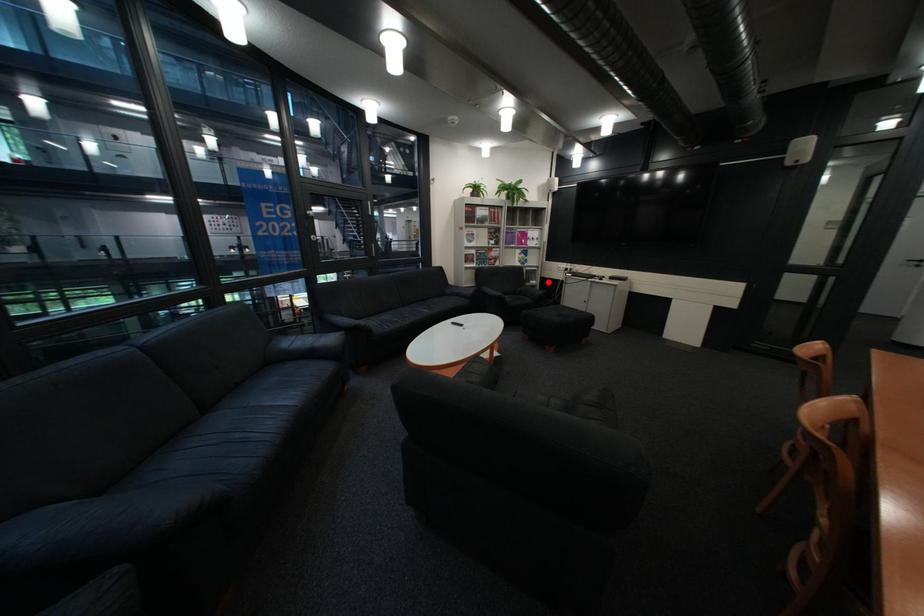
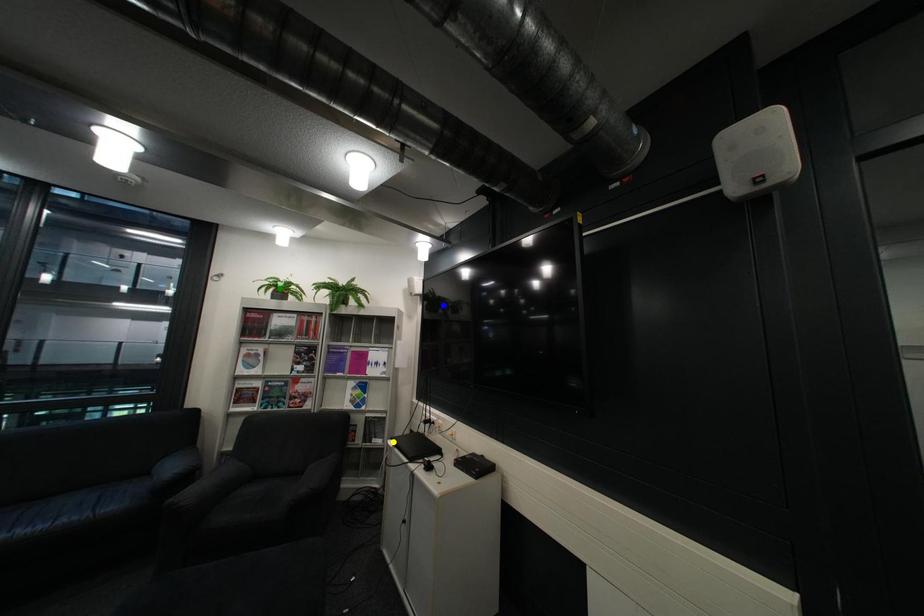
Question: I am providing you with two images of the same scene from different viewpoints. A red point is marked on the first image. You are given multiple points on the second image. In image 2, which mark is for the same physical point as the one in image 1?

Choices:
 (A) green point
 (B) yellow point
 (C) blue point

Answer: (B)